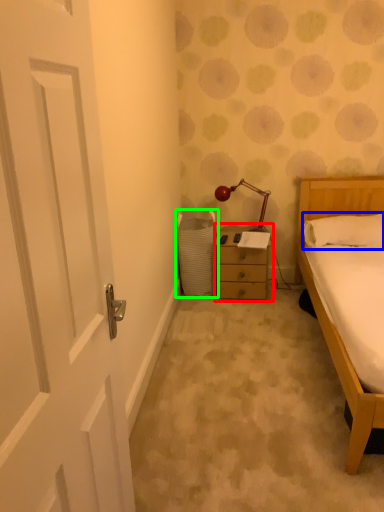
Question: Which object is positioned closest to nightstand (highlighted by a red box)? Select from pillow (highlighted by a blue box) and laundry basket (highlighted by a green box).

Choices:
 (A) pillow
 (B) laundry basket

Answer: (B)